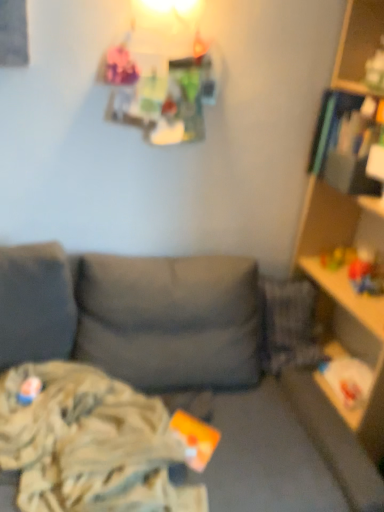
Image resolution: width=384 pixels, height=512 pixels. Describe the element at coordinates (90, 444) in the screenshot. I see `camouflage fabric blanket at lower left` at that location.

You are a GUI agent. You are given a task and a screenshot of the screen. Output one action in this format:
    pyautogui.click(x=<x>, y=<y>)
    Task: Click on the rubberized yellow toy at right, which is the second toy from left to right
    The image size is (384, 512).
    Given the screenshot: What is the action you would take?
    pyautogui.click(x=337, y=257)

Measure the distance from rubberized yellow toy at right, which is the second toy from bottom to top, to wooden shelf at right.

rubberized yellow toy at right, which is the second toy from bottom to top, and wooden shelf at right are 28.30 centimeters apart.

Is wooden shelf at right surrounded by rubberized yellow toy at right, acting as the 1th toy starting from the top?

No, wooden shelf at right is not inside rubberized yellow toy at right, acting as the 1th toy starting from the top.

Which is behind, point (331, 255) or point (377, 223)?

The point (331, 255) is more distant.

Considering the sizes of objects rubberized yellow toy at right, which is the second toy from left to right, and wooden shelf at right in the image provided, who is wider, rubberized yellow toy at right, which is the second toy from left to right, or wooden shelf at right?

wooden shelf at right is wider.

Is rubberized yellow toy at right, the first toy viewed from the back, facing towards camouflage fabric blanket at lower left?

No, rubberized yellow toy at right, the first toy viewed from the back, is not turned towards camouflage fabric blanket at lower left.

Is rubberized yellow toy at right, the first toy viewed from the back, wider or thinner than camouflage fabric blanket at lower left?

Considering their sizes, rubberized yellow toy at right, the first toy viewed from the back, looks slimmer than camouflage fabric blanket at lower left.

What's the angular difference between rubberized yellow toy at right, the first toy viewed from the back, and camouflage fabric blanket at lower left's facing directions?

They differ by 73.3 degrees in their facing directions.

Where is `clothing on the left of the rubberized yellow toy at right, acting as the 1th toy starting from the top`? clothing on the left of the rubberized yellow toy at right, acting as the 1th toy starting from the top is located at coordinates (90, 444).

From the image's perspective, would you say wooden shelf at right is positioned over rubberized yellow toy at right, which is counted as the first toy, starting from the right?

No, from the image's perspective, wooden shelf at right is not over rubberized yellow toy at right, which is counted as the first toy, starting from the right.

Is wooden shelf at right oriented towards rubberized yellow toy at right, which is the second toy from bottom to top?

Yes, wooden shelf at right is oriented towards rubberized yellow toy at right, which is the second toy from bottom to top.

Between wooden shelf at right and rubberized yellow toy at right, acting as the 1th toy starting from the top, which one appears on the right side from the viewer's perspective?

From the viewer's perspective, wooden shelf at right appears more on the right side.

Which is in front, point (314, 191) or point (335, 261)?

Positioned in front is point (314, 191).

Which object is closer to the camera, camouflage fabric blanket at lower left or wooden shelf at right?

wooden shelf at right is in front.

Between point (18, 456) and point (344, 66), which one is positioned in front?

The point (18, 456) is closer.

Between camouflage fabric blanket at lower left and wooden shelf at right, which one has more height?

wooden shelf at right.

Which object is further away from the camera taking this photo, camouflage fabric blanket at lower left or matte plastic toy at lower left, placed as the second toy when sorted from right to left?

Positioned behind is matte plastic toy at lower left, placed as the second toy when sorted from right to left.

Is camouflage fabric blanket at lower left aimed at matte plastic toy at lower left, which is counted as the 1th toy, starting from the bottom?

Yes, camouflage fabric blanket at lower left is oriented towards matte plastic toy at lower left, which is counted as the 1th toy, starting from the bottom.

Between point (113, 488) and point (22, 403), which one is positioned behind?

Point (22, 403)

From the image's perspective, which one is positioned higher, camouflage fabric blanket at lower left or matte plastic toy at lower left, which is the first toy in left-to-right order?

matte plastic toy at lower left, which is the first toy in left-to-right order, appears higher in the image.

Which point is more distant from viewer, (34, 395) or (350, 244)?

The point (350, 244) is farther from the camera.

From the image's perspective, which is above, matte plastic toy at lower left, acting as the second toy starting from the top, or wooden shelf at right?

wooden shelf at right is shown above in the image.

I want to click on toy that appears in front of the rubberized yellow toy at right, which is counted as the first toy, starting from the right, so click(x=29, y=390).

Considering the positions of objects matte plastic toy at lower left, acting as the second toy starting from the top, and rubberized yellow toy at right, acting as the 1th toy starting from the top, in the image provided, who is in front, matte plastic toy at lower left, acting as the second toy starting from the top, or rubberized yellow toy at right, acting as the 1th toy starting from the top,?

matte plastic toy at lower left, acting as the second toy starting from the top, is closer to the camera.

Can you confirm if matte plastic toy at lower left, acting as the second toy starting from the top, is positioned to the right of rubberized yellow toy at right, the first toy viewed from the back?

In fact, matte plastic toy at lower left, acting as the second toy starting from the top, is to the left of rubberized yellow toy at right, the first toy viewed from the back.

Between matte plastic toy at lower left, the 1th toy positioned from the front, and rubberized yellow toy at right, acting as the 1th toy starting from the top, which one has larger width?

rubberized yellow toy at right, acting as the 1th toy starting from the top.

Image resolution: width=384 pixels, height=512 pixels. Find the location of `shelf on the right of the rubberized yellow toy at right, which is the second toy from left to right`. shelf on the right of the rubberized yellow toy at right, which is the second toy from left to right is located at coordinates (350, 276).

Where is `clothing in front of the rubberized yellow toy at right, the second toy positioned from the front`? This screenshot has height=512, width=384. clothing in front of the rubberized yellow toy at right, the second toy positioned from the front is located at coordinates (90, 444).

Looking at the image, which one is located further to matte plastic toy at lower left, which is the first toy in left-to-right order, wooden shelf at right or rubberized yellow toy at right, the first toy viewed from the back?

wooden shelf at right.

From the image, which object appears to be nearer to wooden shelf at right, matte plastic toy at lower left, which appears as the second toy when viewed from the back, or camouflage fabric blanket at lower left?

Among the two, camouflage fabric blanket at lower left is located nearer to wooden shelf at right.

Considering their positions, is wooden shelf at right positioned closer to camouflage fabric blanket at lower left than rubberized yellow toy at right, which is the second toy from bottom to top?

Among the two, wooden shelf at right is located nearer to camouflage fabric blanket at lower left.

Based on their spatial positions, is wooden shelf at right or matte plastic toy at lower left, the 1th toy positioned from the front, further from camouflage fabric blanket at lower left?

wooden shelf at right is further to camouflage fabric blanket at lower left.

Looking at the image, which one is located closer to wooden shelf at right, camouflage fabric blanket at lower left or rubberized yellow toy at right, the first toy viewed from the back?

rubberized yellow toy at right, the first toy viewed from the back, is closer to wooden shelf at right.

Which object lies nearer to the anchor point matte plastic toy at lower left, acting as the second toy starting from the top, camouflage fabric blanket at lower left or wooden shelf at right?

Among the two, camouflage fabric blanket at lower left is located nearer to matte plastic toy at lower left, acting as the second toy starting from the top.

When comparing their distances from rubberized yellow toy at right, acting as the 1th toy starting from the top, does camouflage fabric blanket at lower left or matte plastic toy at lower left, which is counted as the 1th toy, starting from the bottom, seem further?

matte plastic toy at lower left, which is counted as the 1th toy, starting from the bottom, is positioned further to the anchor rubberized yellow toy at right, acting as the 1th toy starting from the top.

From the image, which object appears to be farther from matte plastic toy at lower left, acting as the second toy starting from the top, camouflage fabric blanket at lower left or rubberized yellow toy at right, which is the second toy from bottom to top?

rubberized yellow toy at right, which is the second toy from bottom to top, is further to matte plastic toy at lower left, acting as the second toy starting from the top.

At what (x,y) coordinates should I click in order to perform the action: click on clothing between matte plastic toy at lower left, which is counted as the 1th toy, starting from the bottom, and rubberized yellow toy at right, which is counted as the first toy, starting from the right, in the horizontal direction. Please return your answer as a coordinate pair (x, y). The height and width of the screenshot is (512, 384). Looking at the image, I should click on (90, 444).

At what (x,y) coordinates should I click in order to perform the action: click on clothing between matte plastic toy at lower left, the 1th toy positioned from the front, and wooden shelf at right. Please return your answer as a coordinate pair (x, y). This screenshot has width=384, height=512. Looking at the image, I should click on (90, 444).

This screenshot has width=384, height=512. Find the location of `toy between matte plastic toy at lower left, which appears as the second toy when viewed from the back, and wooden shelf at right, in the horizontal direction`. toy between matte plastic toy at lower left, which appears as the second toy when viewed from the back, and wooden shelf at right, in the horizontal direction is located at coordinates (337, 257).

Where is `toy between camouflage fabric blanket at lower left and wooden shelf at right from left to right`? toy between camouflage fabric blanket at lower left and wooden shelf at right from left to right is located at coordinates (337, 257).